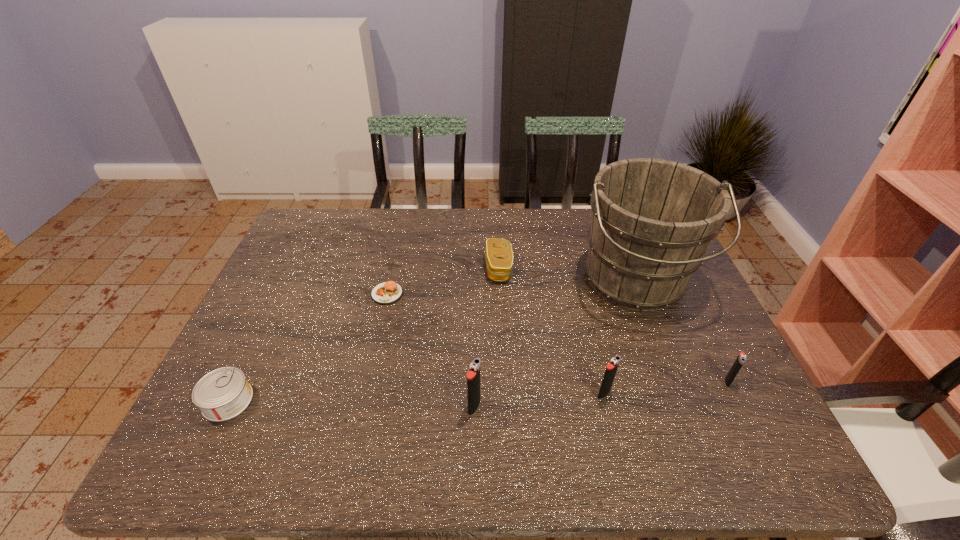
Identify the location of free space that satisfies the following two spatial constraints: 1. on the zipper side of the clutch bag; 2. on the front side of the leftmost igniter. (505, 406).

Find the location of `vacant space that satisfies the following two spatial constraints: 1. on the handle side of the fourth shortest object; 2. on the right side of the bucket`. vacant space that satisfies the following two spatial constraints: 1. on the handle side of the fourth shortest object; 2. on the right side of the bucket is located at coordinates (673, 382).